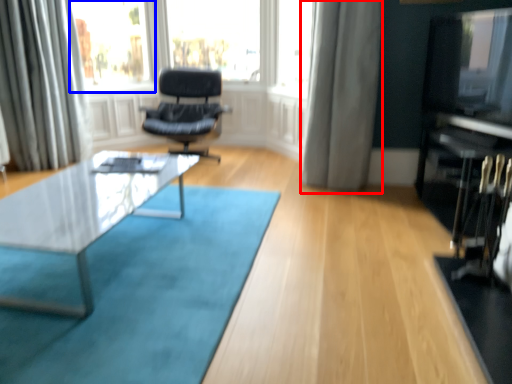
Question: Which point is closer to the camera, curtain (highlighted by a red box) or bay window (highlighted by a blue box)?

Choices:
 (A) curtain
 (B) bay window

Answer: (A)